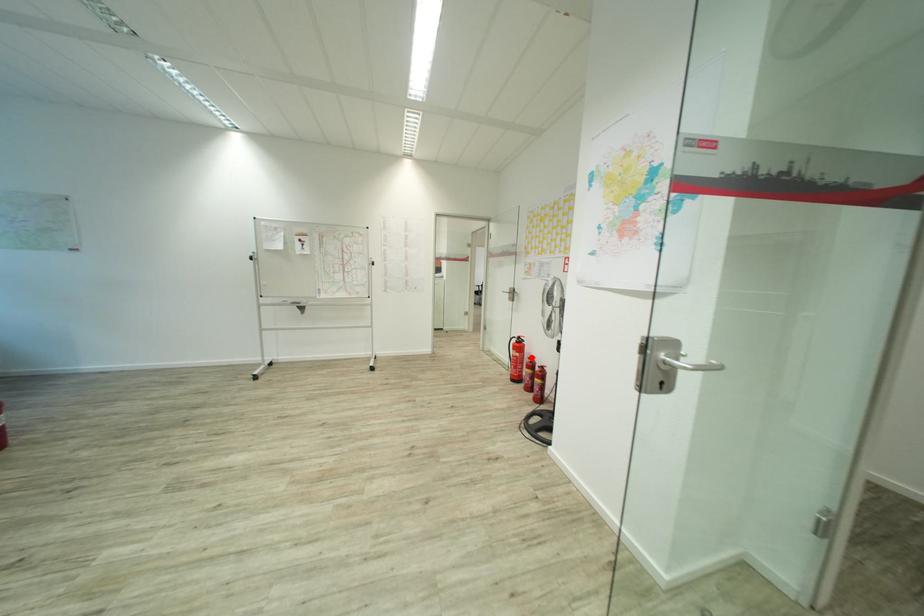
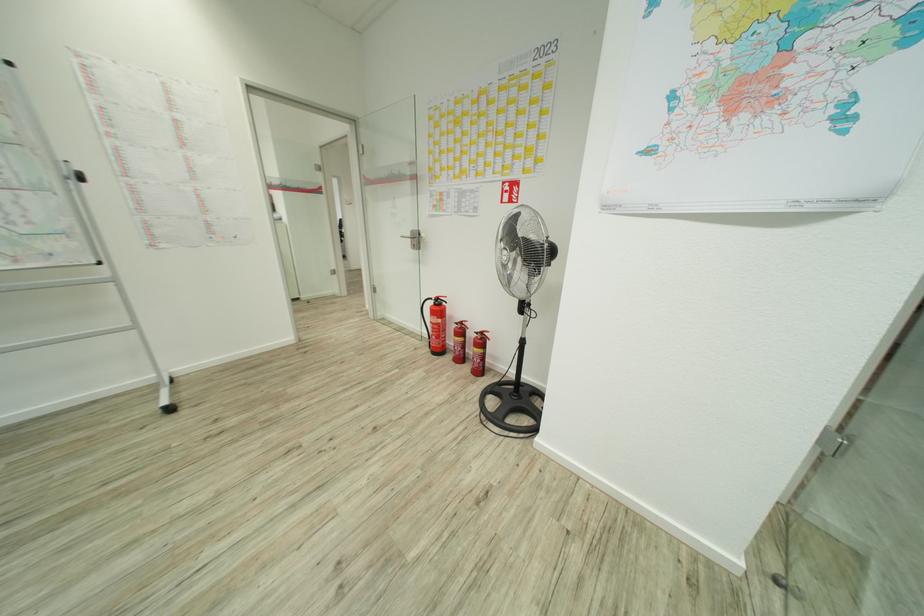
Question: I am providing you with two images of the same scene from different viewpoints. Given a red point in image1, look at the same physical point in image2. Is it:

Choices:
 (A) Closer to the viewpoint
 (B) Farther from the viewpoint

Answer: (A)